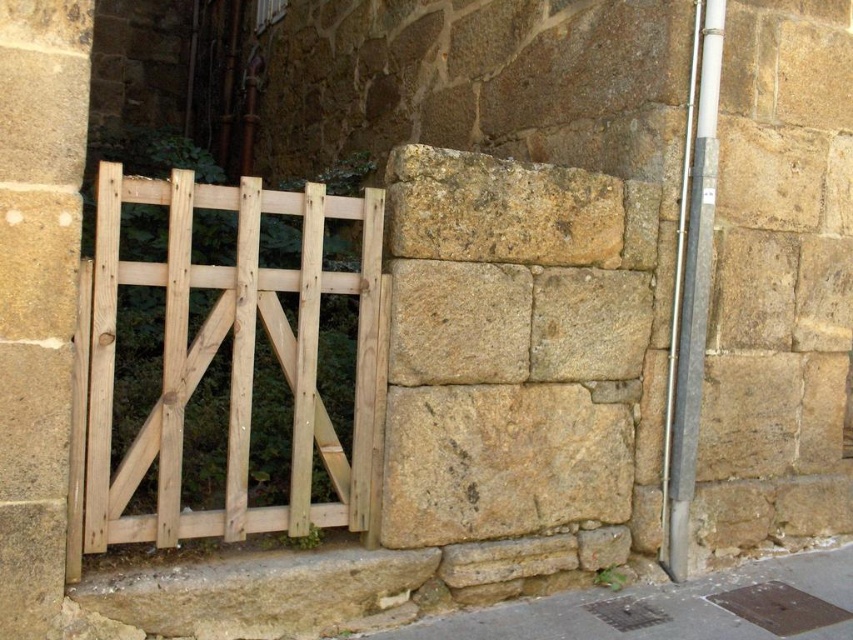
Question: Does natural wood gate at left appear under smooth stone pillar at left?

Choices:
 (A) yes
 (B) no

Answer: (A)

Question: Which point appears closest to the camera in this image?

Choices:
 (A) (704, 8)
 (B) (59, 429)
 (C) (312, 198)
 (D) (827, 556)

Answer: (B)

Question: Which of these objects is positioned farthest from the brown stone wall at lower right?

Choices:
 (A) smooth stone pillar at left
 (B) natural wood gate at left

Answer: (A)

Question: Is natural wood gate at left to the right of brown stone wall at lower right from the viewer's perspective?

Choices:
 (A) yes
 (B) no

Answer: (B)

Question: Can you confirm if natural wood gate at left is wider than gray concrete pole at right?

Choices:
 (A) no
 (B) yes

Answer: (B)

Question: Which object is positioned closest to the smooth stone pillar at left?

Choices:
 (A) gray concrete pole at right
 (B) natural wood gate at left
 (C) brown stone wall at lower right

Answer: (B)